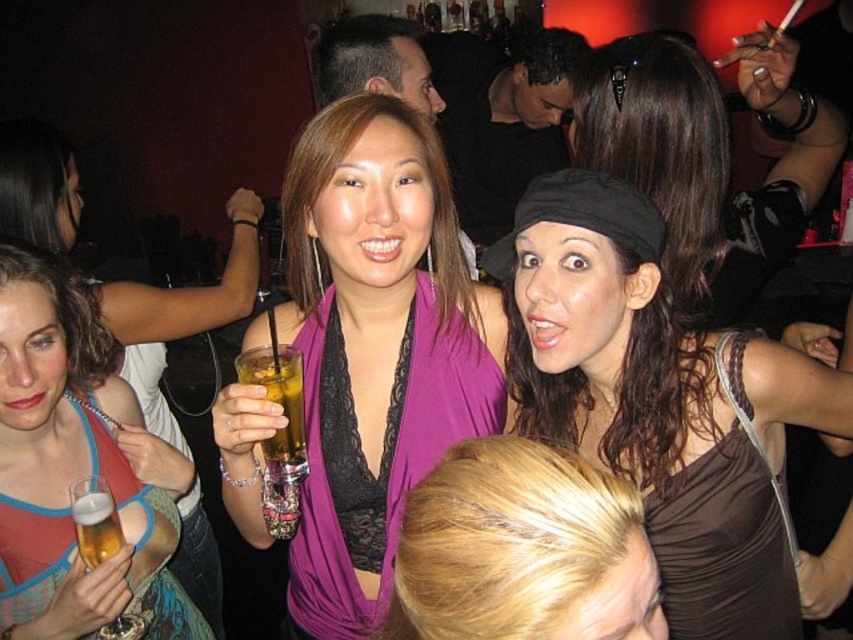
Does matte blue tank top at lower left have a smaller size compared to translucent glass beer at lower left?

No.

Can you confirm if matte blue tank top at lower left is shorter than translucent glass beer at lower left?

No.

Between point (39, 592) and point (94, 500), which one is positioned in front?

Point (94, 500) is more forward.

The height and width of the screenshot is (640, 853). Find the location of `matte blue tank top at lower left`. matte blue tank top at lower left is located at coordinates (77, 472).

Between brown satin dress at upper center and blonde hair at center, which one has less height?

With less height is blonde hair at center.

Image resolution: width=853 pixels, height=640 pixels. Identify the location of brown satin dress at upper center. pos(660,401).

Does shiny black hat at center appear under blonde hair at center?

No, shiny black hat at center is not below blonde hair at center.

Is point (738, 61) positioned in front of point (608, 625)?

No, it is behind (608, 625).

You are a GUI agent. You are given a task and a screenshot of the screen. Output one action in this format:
    pyautogui.click(x=<x>, y=<y>)
    Task: Click on the shiny black hat at center
    
    Given the screenshot: What is the action you would take?
    pyautogui.click(x=706, y=157)